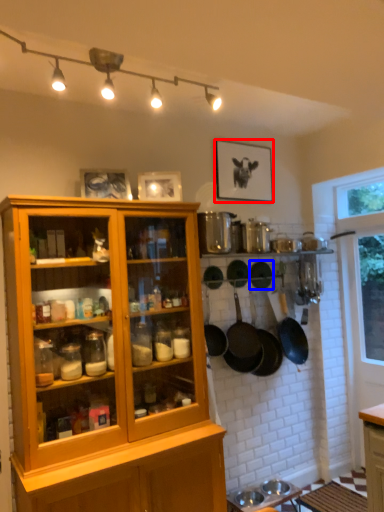
Question: Which object appears closest to the camera in this image, picture frame (highlighted by a red box) or frying pan (highlighted by a blue box)?

Choices:
 (A) picture frame
 (B) frying pan

Answer: (A)